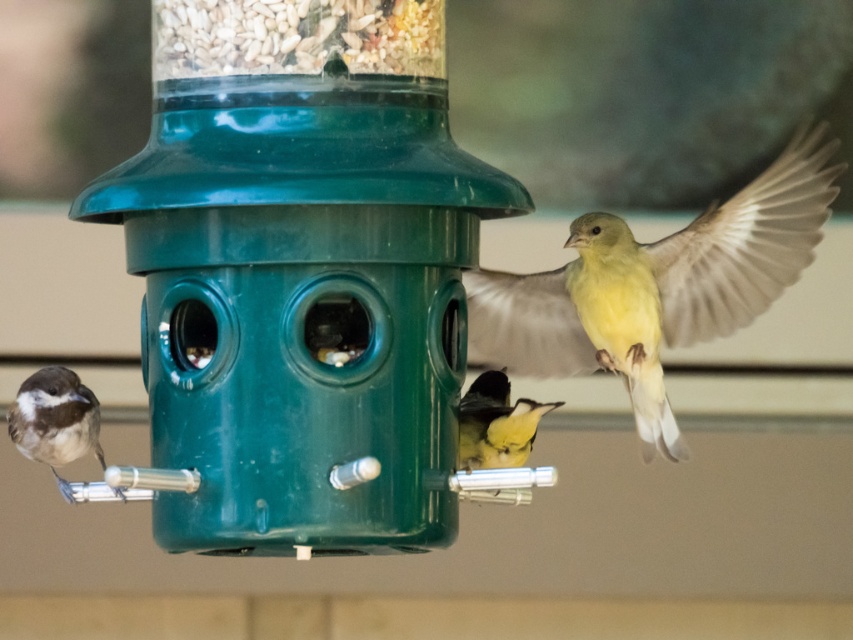
You are a bird with a wingspan of 10 inches. You want to fly from the brown speckled feathers at left to the green plastic bird feeder at center. Can you reach it without flapping your wings?

The distance between the brown speckled feathers at left and the green plastic bird feeder at center is 12.28 inches. Since your wingspan is 10 inches, you cannot reach it without flapping your wings because the distance exceeds your wingspan.

You are a bird watching enthusiast standing in the garden. You notice the green plastic bird feeder at center and the brown speckled feathers at left. Which object is closer to you?

The green plastic bird feeder at center is closer to the viewer than the brown speckled feathers at left.

You are a birdwatcher observing the scene. You notice the green plastic bird feeder at center and the yellow matte bird at upper right. Which object is positioned to the right side of the other?

The green plastic bird feeder at center is to the left of the yellow matte bird at upper right, so the yellow matte bird at upper right is positioned to the right side of the green plastic bird feeder at center.